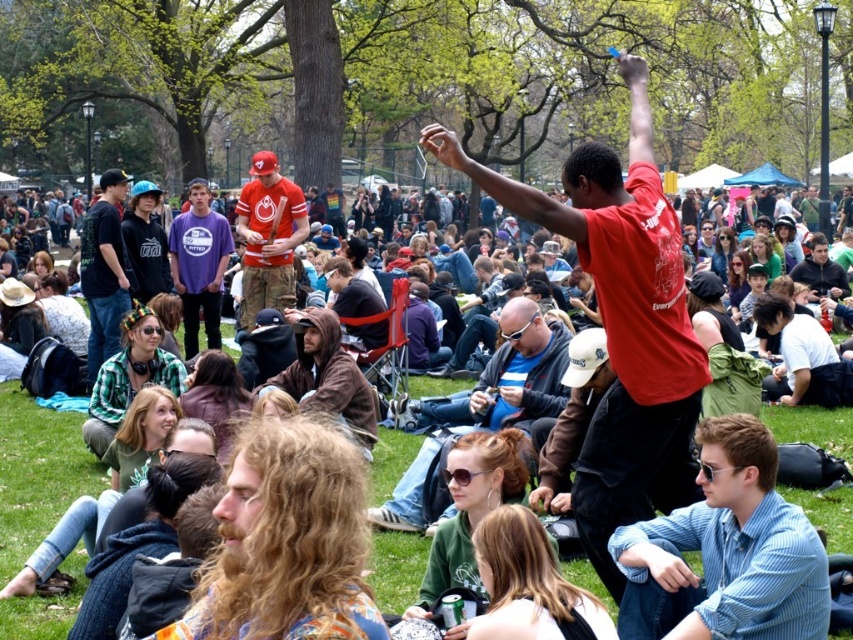
You are a photographer positioned at the back of the scene wanting to capture both the matte red shirt at center and the matte black jacket at left in your photo. Which object will appear larger in your photo?

The matte red shirt at center will appear larger in the photo because it is closer to the viewer than the matte black jacket at left.

You are at the park and see two people wearing a matte black jacket at left and a purple cotton shirt at center. Which one is positioned more to the left side of the scene?

The matte black jacket at left is positioned more to the left side of the scene than the purple cotton shirt at center.